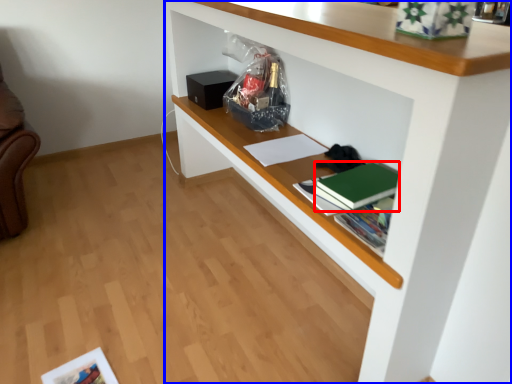
Question: Which object appears closest to the camera in this image, paperback book (highlighted by a red box) or shelf (highlighted by a blue box)?

Choices:
 (A) paperback book
 (B) shelf

Answer: (B)